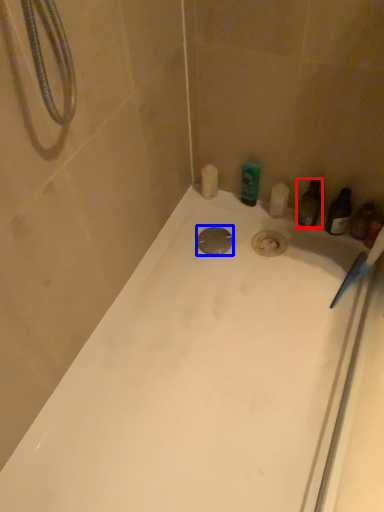
Question: Among these objects, which one is farthest to the camera, toiletry (highlighted by a red box) or drain (highlighted by a blue box)?

Choices:
 (A) toiletry
 (B) drain

Answer: (B)